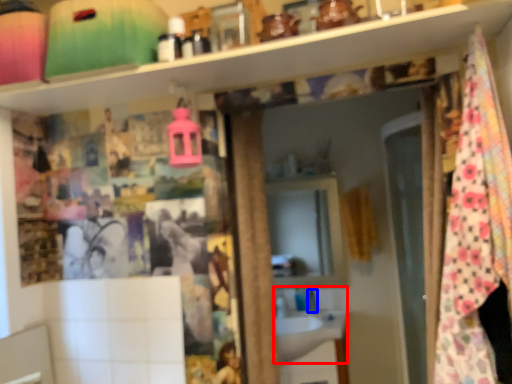
Question: Which of the following is the closest to the observer, sink (highlighted by a red box) or faucet (highlighted by a blue box)?

Choices:
 (A) sink
 (B) faucet

Answer: (A)